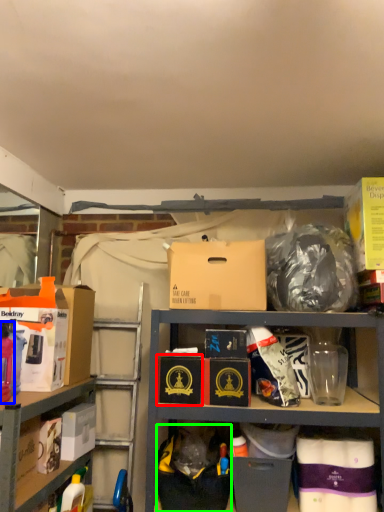
Question: Estimate the real-world distances between objects in this image. Which object is closer to box (highlighted by a red box), bottle (highlighted by a blue box) or garbage (highlighted by a green box)?

Choices:
 (A) bottle
 (B) garbage

Answer: (B)